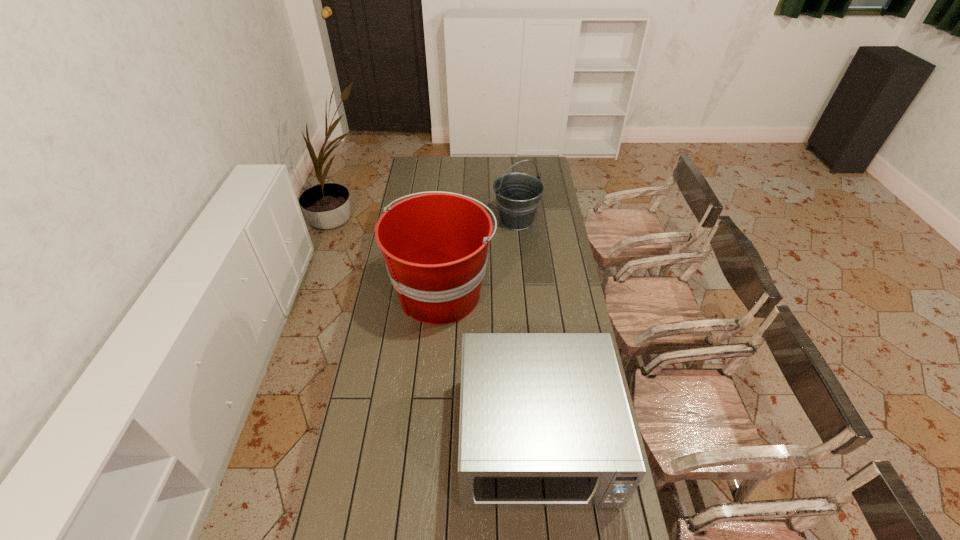
At what (x,y) coordinates should I click in order to perform the action: click on the nearer bucket. Please return your answer as a coordinate pair (x, y). The width and height of the screenshot is (960, 540). Looking at the image, I should click on (435, 245).

You are a GUI agent. You are given a task and a screenshot of the screen. Output one action in this format:
    pyautogui.click(x=<x>, y=<y>)
    Task: Click on the farther bucket
    This screenshot has height=540, width=960.
    Given the screenshot: What is the action you would take?
    pyautogui.click(x=518, y=194)

I want to click on the shortest object, so click(x=545, y=422).

What are the coordinates of `microwave oven` in the screenshot? It's located at (545, 422).

Locate an element on the screen. This screenshot has height=540, width=960. vacant space located 0.090m on the back of the second farthest object is located at coordinates (446, 245).

Where is `free space located 0.390m on the left of the farther bucket`? The width and height of the screenshot is (960, 540). free space located 0.390m on the left of the farther bucket is located at coordinates (418, 221).

Locate an element on the screen. This screenshot has height=540, width=960. object present at the left edge is located at coordinates (435, 245).

At what (x,y) coordinates should I click in order to perform the action: click on bucket present at the right edge. Please return your answer as a coordinate pair (x, y). Image resolution: width=960 pixels, height=540 pixels. Looking at the image, I should click on (518, 194).

Where is `microwave oven at the right edge`? The width and height of the screenshot is (960, 540). microwave oven at the right edge is located at coordinates (545, 422).

Where is `free region at the far edge of the desktop`? The image size is (960, 540). free region at the far edge of the desktop is located at coordinates (x=516, y=163).